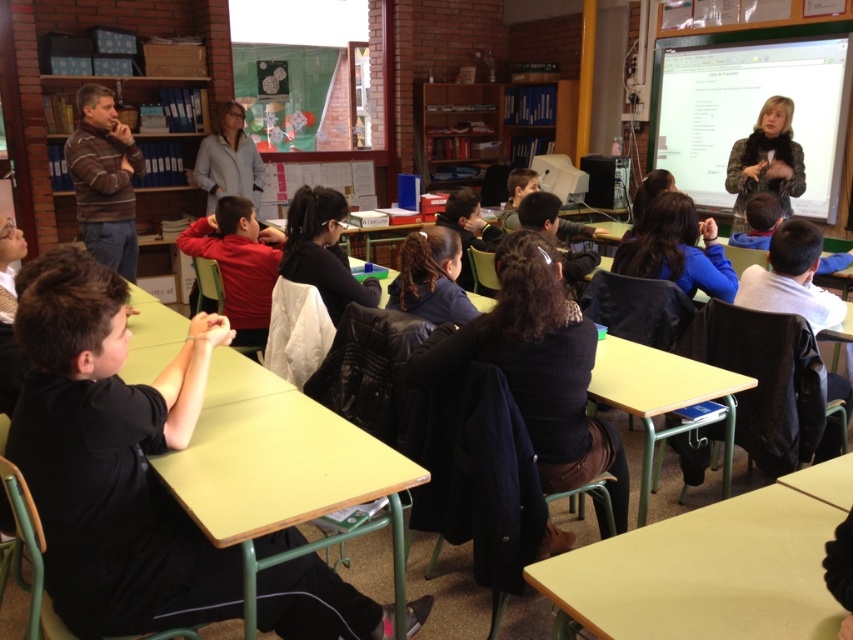
Does black fabric shirt at center lie behind light blue jacket at upper center?

No, it is in front of light blue jacket at upper center.

Who is more distant from viewer, (64, 314) or (219, 109)?

The point (219, 109) is more distant.

Identify the location of black fabric shirt at center. Image resolution: width=853 pixels, height=640 pixels. (113, 461).

Does light wood table at lower right appear over striped sweater at left?

Incorrect, light wood table at lower right is not positioned above striped sweater at left.

Who is higher up, light wood table at lower right or striped sweater at left?

striped sweater at left is higher up.

Which is in front, point (827, 632) or point (97, 177)?

Point (827, 632) is more forward.

Identify the location of light wood table at lower right. (705, 573).

Does black fabric shirt at center have a larger size compared to light wood table at lower right?

Indeed, black fabric shirt at center has a larger size compared to light wood table at lower right.

In the scene shown: Who is higher up, black fabric shirt at center or light wood table at lower right?

black fabric shirt at center is above.

The image size is (853, 640). What do you see at coordinates (113, 461) in the screenshot? I see `black fabric shirt at center` at bounding box center [113, 461].

This screenshot has height=640, width=853. In order to click on black fabric shirt at center in this screenshot , I will do `click(113, 461)`.